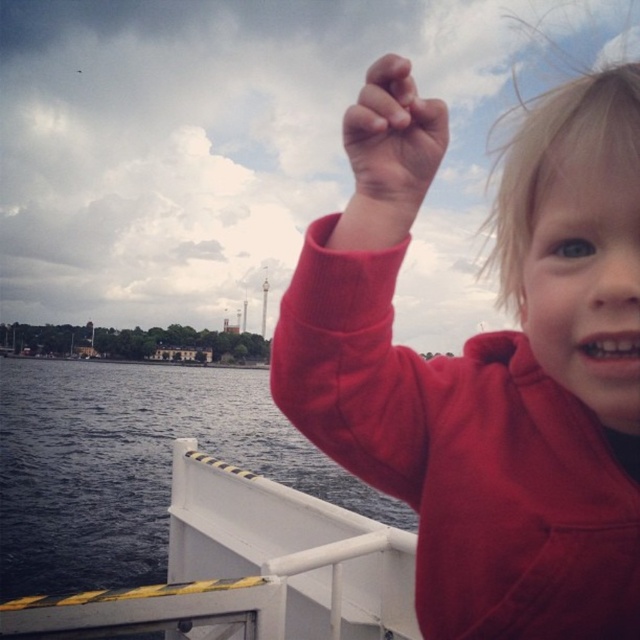
Question: Which point is farther to the camera?

Choices:
 (A) matte skin hand at upper center
 (B) dark blue water at lower left
 (C) red fleece sweater at upper right

Answer: (B)

Question: Does dark blue water at lower left appear on the left side of matte skin hand at upper center?

Choices:
 (A) yes
 (B) no

Answer: (A)

Question: Is red fleece sweater at upper right wider than matte skin hand at upper center?

Choices:
 (A) yes
 (B) no

Answer: (A)

Question: Can you confirm if red fleece sweater at upper right is thinner than dark blue water at lower left?

Choices:
 (A) yes
 (B) no

Answer: (A)

Question: Considering the real-world distances, which object is farthest from the dark blue water at lower left?

Choices:
 (A) red fleece sweater at upper right
 (B) matte skin hand at upper center

Answer: (B)

Question: Estimate the real-world distances between objects in this image. Which object is farther from the dark blue water at lower left?

Choices:
 (A) red fleece sweater at upper right
 (B) matte skin hand at upper center

Answer: (B)